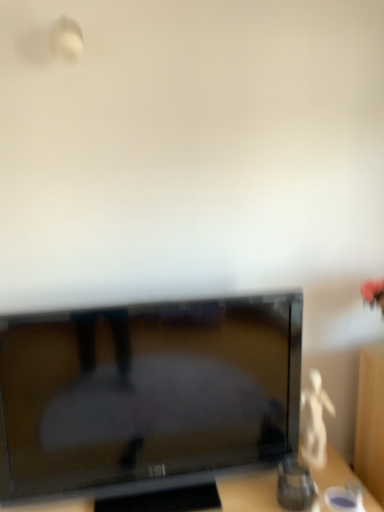
This screenshot has width=384, height=512. I want to click on black glossy television at center, so click(147, 396).

What do you see at coordinates (147, 396) in the screenshot? The height and width of the screenshot is (512, 384). I see `black glossy television at center` at bounding box center [147, 396].

The image size is (384, 512). I want to click on black glossy television at center, so click(147, 396).